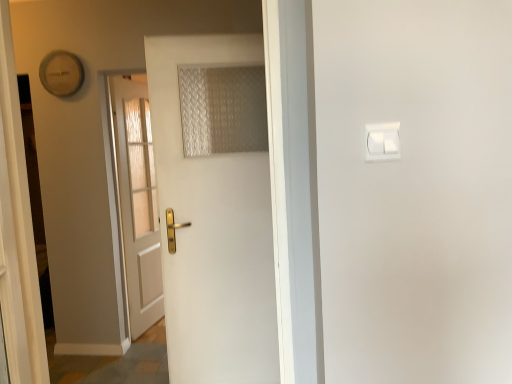
Question: Should I look upward or downward to see white wooden door at center, the first door in the left-to-right sequence?

Choices:
 (A) up
 (B) down

Answer: (B)

Question: Is white wooden door at center, the first door in the left-to-right sequence, positioned with its back to translucent fabric curtain at center?

Choices:
 (A) yes
 (B) no

Answer: (B)

Question: Considering the relative sizes of white wooden door at center, marked as the 2th door in a front-to-back arrangement, and translucent fabric curtain at center in the image provided, is white wooden door at center, marked as the 2th door in a front-to-back arrangement, bigger than translucent fabric curtain at center?

Choices:
 (A) no
 (B) yes

Answer: (B)

Question: Is white wooden door at center, which ranks as the 2th door in right-to-left order, closer to camera compared to translucent fabric curtain at center?

Choices:
 (A) no
 (B) yes

Answer: (A)

Question: Can you confirm if white wooden door at center, marked as the 2th door in a front-to-back arrangement, is positioned to the left of translucent fabric curtain at center?

Choices:
 (A) no
 (B) yes

Answer: (B)

Question: Is there a large distance between white wooden door at center, the first door in the left-to-right sequence, and translucent fabric curtain at center?

Choices:
 (A) no
 (B) yes

Answer: (B)

Question: From the image's perspective, is white wooden door at center, the first door in the left-to-right sequence, above translucent fabric curtain at center?

Choices:
 (A) no
 (B) yes

Answer: (A)

Question: Is wooden clock at upper left facing away from white matte door at center, placed as the 1th door when sorted from front to back?

Choices:
 (A) yes
 (B) no

Answer: (B)

Question: Is there a large distance between wooden clock at upper left and white matte door at center, placed as the second door when sorted from left to right?

Choices:
 (A) no
 (B) yes

Answer: (B)

Question: From a real-world perspective, is wooden clock at upper left beneath white matte door at center, which is the second door in back-to-front order?

Choices:
 (A) yes
 (B) no

Answer: (B)

Question: From a real-world perspective, does wooden clock at upper left stand above white matte door at center, placed as the 1th door when sorted from front to back?

Choices:
 (A) yes
 (B) no

Answer: (A)

Question: From the image's perspective, is wooden clock at upper left below white matte door at center, which is the second door in back-to-front order?

Choices:
 (A) no
 (B) yes

Answer: (A)

Question: Does wooden clock at upper left lie in front of white matte door at center, placed as the second door when sorted from left to right?

Choices:
 (A) yes
 (B) no

Answer: (B)

Question: Is wooden clock at upper left touching white wooden door at center, marked as the 2th door in a front-to-back arrangement?

Choices:
 (A) yes
 (B) no

Answer: (B)